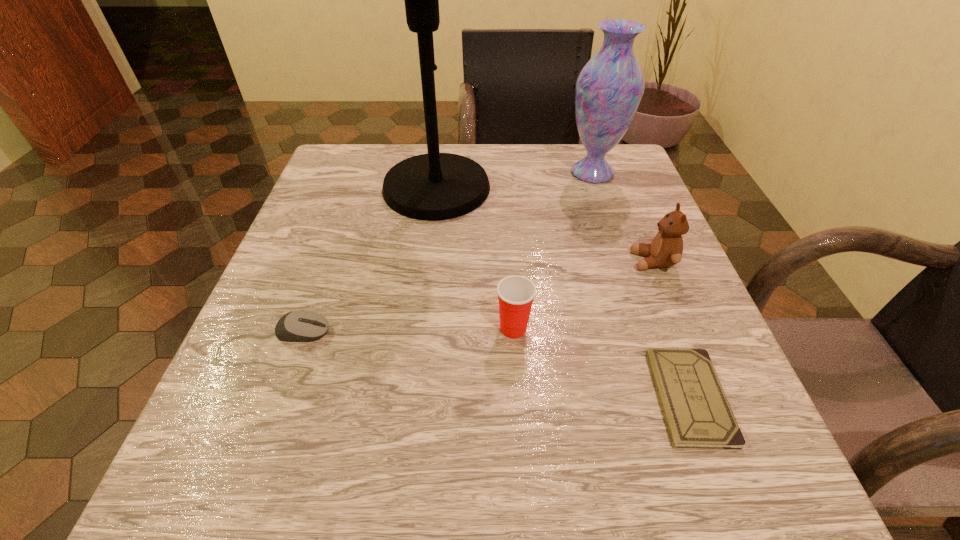
Identify the location of vacant space at the left edge of the desktop. (353, 279).

Find the location of a particular element. free region at the right edge of the desktop is located at coordinates (619, 251).

At what (x,y) coordinates should I click in order to perform the action: click on free space at the far left corner of the desktop. Please return your answer as a coordinate pair (x, y). This screenshot has width=960, height=540. Looking at the image, I should click on (348, 171).

In the image, there is a desktop. Identify the location of vacant region at the near left corner. Image resolution: width=960 pixels, height=540 pixels. (211, 476).

The width and height of the screenshot is (960, 540). I want to click on vacant area that lies between the nearest object and the second shortest object, so click(x=496, y=364).

The width and height of the screenshot is (960, 540). In order to click on free area in between the second tallest object and the shortest object in this screenshot , I will do (641, 285).

Identify the location of vacant region between the Dixie cup and the table lamp. (475, 258).

At what (x,y) coordinates should I click in order to perform the action: click on vacant area that lies between the fifth tallest object and the checkbook. Please return your answer as a coordinate pair (x, y). This screenshot has height=540, width=960. Looking at the image, I should click on (496, 364).

You are a GUI agent. You are given a task and a screenshot of the screen. Output one action in this format:
    pyautogui.click(x=<x>, y=<y>)
    Task: Click on the vacant space that's between the Dixie cup and the second tallest object
    
    Given the screenshot: What is the action you would take?
    pyautogui.click(x=553, y=251)

Where is `vacant area that lies between the tallest object and the shortest object`? The image size is (960, 540). vacant area that lies between the tallest object and the shortest object is located at coordinates (564, 293).